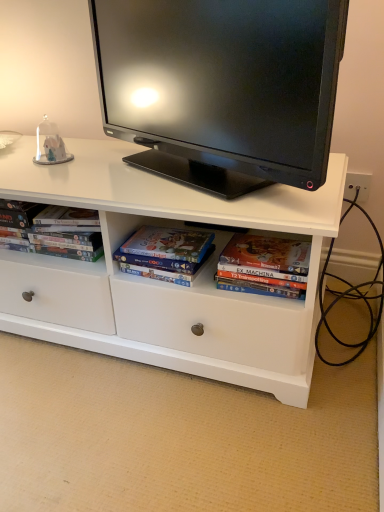
Question: Does point (198, 23) appear closer or farther from the camera than point (48, 231)?

Choices:
 (A) farther
 (B) closer

Answer: (B)

Question: Looking at the image, does black glossy tv at upper center seem bigger or smaller compared to matte black dvd case at left?

Choices:
 (A) small
 (B) big

Answer: (B)

Question: Which is farther from the black glossy tv at upper center?

Choices:
 (A) matte cardboard book at center
 (B) matte black dvd case at left

Answer: (A)

Question: Which object is the closest to the matte cardboard book at center?

Choices:
 (A) black glossy tv at upper center
 (B) matte black dvd case at left

Answer: (B)